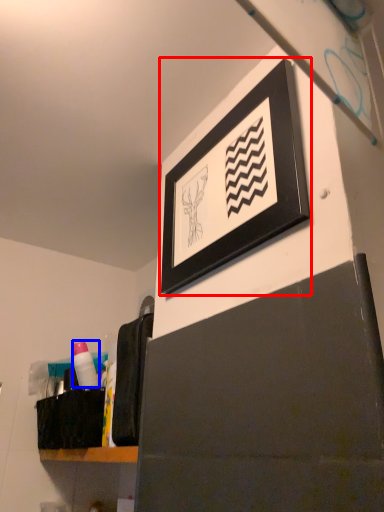
Question: Which of the following is the farthest to the observer, picture frame (highlighted by a red box) or toiletry (highlighted by a blue box)?

Choices:
 (A) picture frame
 (B) toiletry

Answer: (B)